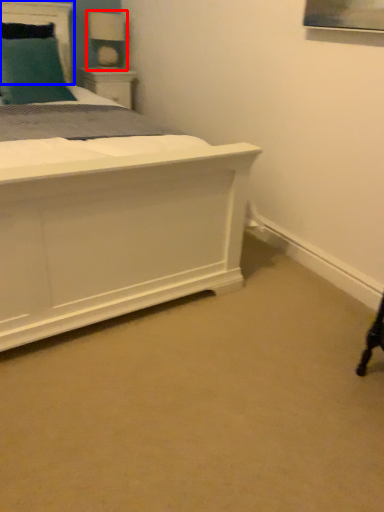
Question: Which point is further to the camera, table lamp (highlighted by a red box) or headboard (highlighted by a blue box)?

Choices:
 (A) table lamp
 (B) headboard

Answer: (A)